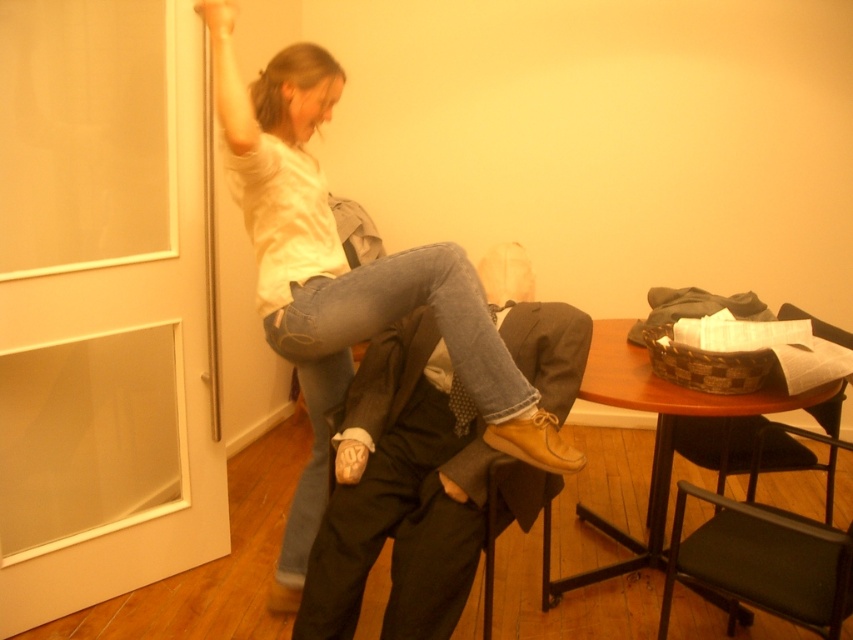
Does point (556, 422) lie in front of point (421, 404)?

Yes, it is in front of point (421, 404).

Is denim jeans at center to the left of dark brown fabric pants at center from the viewer's perspective?

Indeed, denim jeans at center is positioned on the left side of dark brown fabric pants at center.

Is point (314, 324) positioned in front of point (410, 593)?

No, it is not.

The height and width of the screenshot is (640, 853). In order to click on denim jeans at center in this screenshot , I will do `click(346, 276)`.

Between dark brown fabric pants at center and wooden table at center, which one appears on the right side from the viewer's perspective?

wooden table at center is more to the right.

Where is `dark brown fabric pants at center`? dark brown fabric pants at center is located at coordinates (399, 497).

The height and width of the screenshot is (640, 853). In order to click on dark brown fabric pants at center in this screenshot , I will do `click(399, 497)`.

Is the position of white translucent screen door at left more distant than that of green fabric chair at lower right?

Yes, white translucent screen door at left is further from the viewer.

What are the coordinates of `white translucent screen door at left` in the screenshot? It's located at (181, 376).